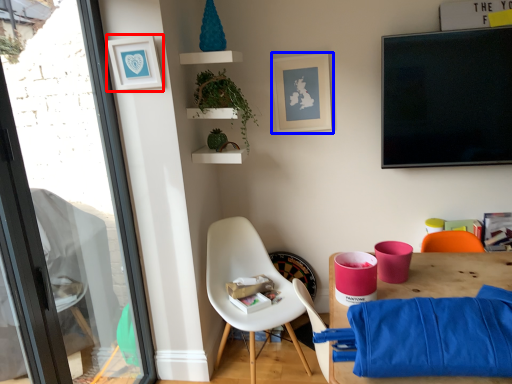
Question: Among these objects, which one is farthest to the camera, picture frame (highlighted by a red box) or picture frame (highlighted by a blue box)?

Choices:
 (A) picture frame
 (B) picture frame

Answer: (B)